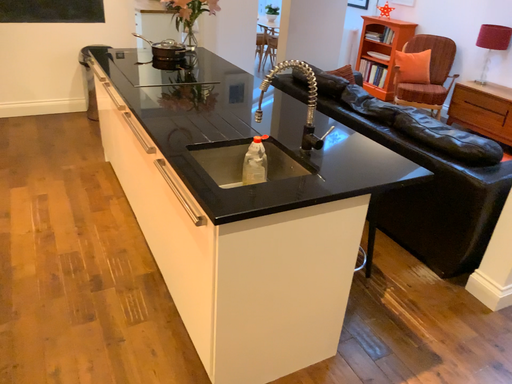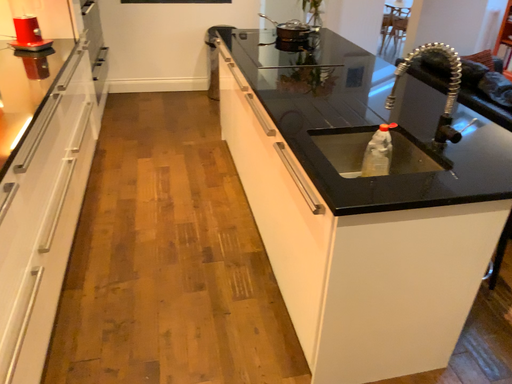
Question: Which way did the camera rotate in the video?

Choices:
 (A) rotated right
 (B) rotated left

Answer: (B)